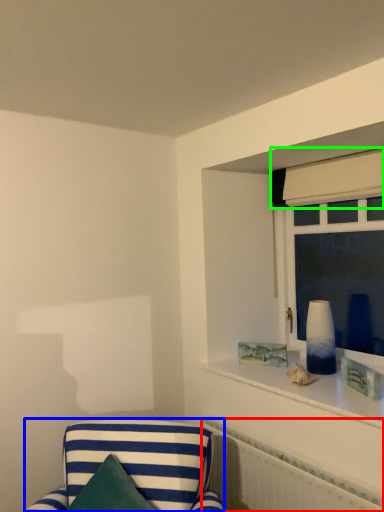
Question: Based on their relative distances, which object is nearer to radiator (highlighted by a red box)? Choose from furniture (highlighted by a blue box) and curtain (highlighted by a green box).

Choices:
 (A) furniture
 (B) curtain

Answer: (A)